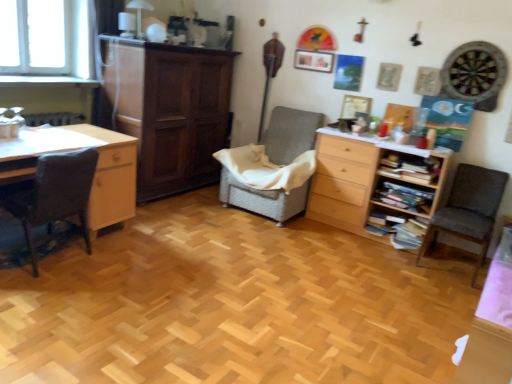
In order to click on empty space that is in between light wood desk at left and woven fabric chair at center, arranged as the 2th chair when viewed from the left in this screenshot , I will do `click(183, 224)`.